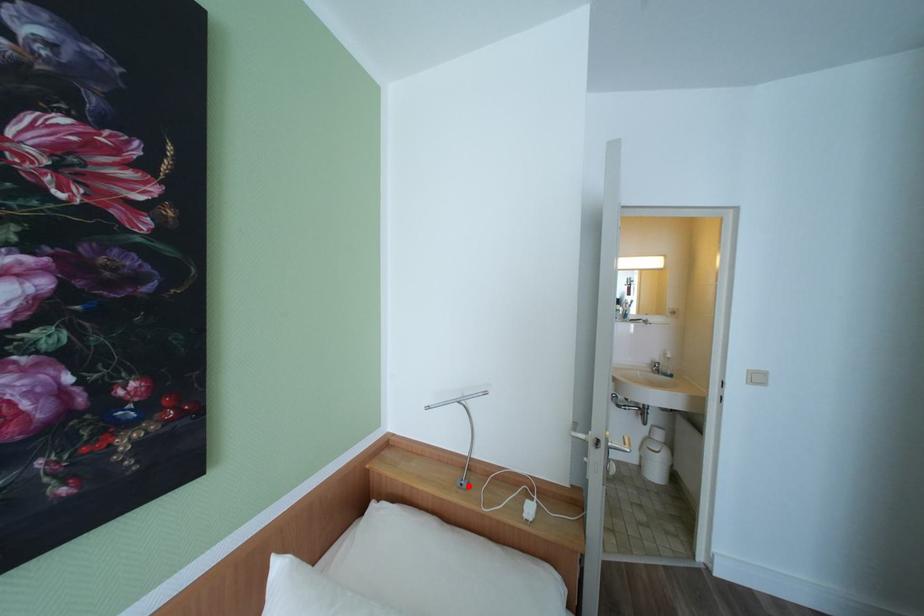
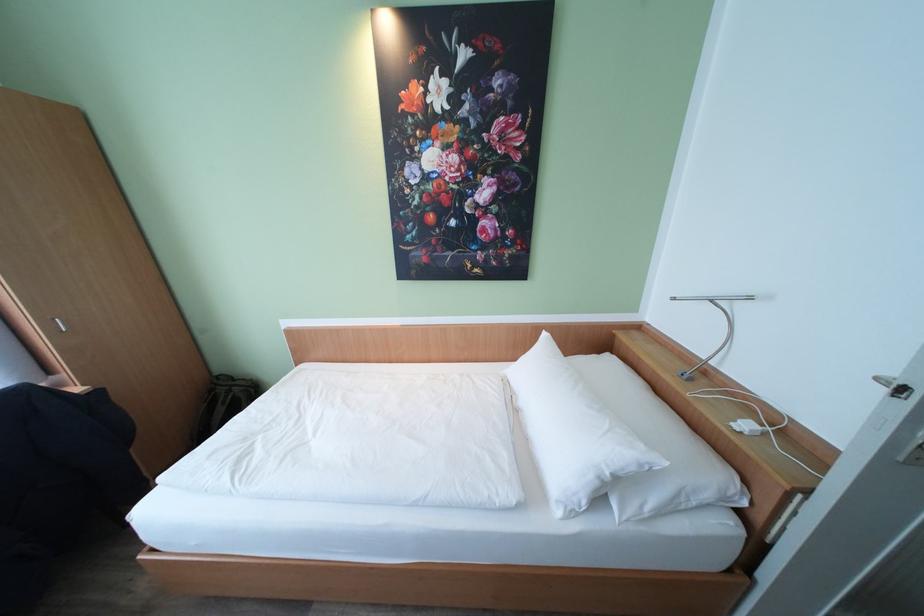
The point at the highlighted location is marked in the first image. Where is the corresponding point in the second image?

(689, 377)